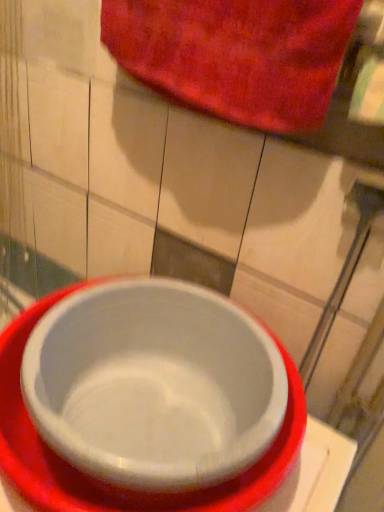
Question: From a real-world perspective, is white plastic bowl at center physically located above or below velvety red towel at upper center?

Choices:
 (A) above
 (B) below

Answer: (B)

Question: Considering the positions of white plastic bowl at center and velvety red towel at upper center in the image, is white plastic bowl at center wider or thinner than velvety red towel at upper center?

Choices:
 (A) wide
 (B) thin

Answer: (A)

Question: Based on their sizes in the image, would you say white plastic bowl at center is bigger or smaller than velvety red towel at upper center?

Choices:
 (A) small
 (B) big

Answer: (B)

Question: Considering the positions of point (246, 123) and point (122, 394), is point (246, 123) closer or farther from the camera than point (122, 394)?

Choices:
 (A) farther
 (B) closer

Answer: (B)

Question: Based on their positions, is velvety red towel at upper center located to the left or right of white plastic bowl at center?

Choices:
 (A) right
 (B) left

Answer: (A)

Question: From the image's perspective, is velvety red towel at upper center positioned above or below white plastic bowl at center?

Choices:
 (A) below
 (B) above

Answer: (B)

Question: From a real-world perspective, relative to white plastic bowl at center, is velvety red towel at upper center vertically above or below?

Choices:
 (A) above
 (B) below

Answer: (A)